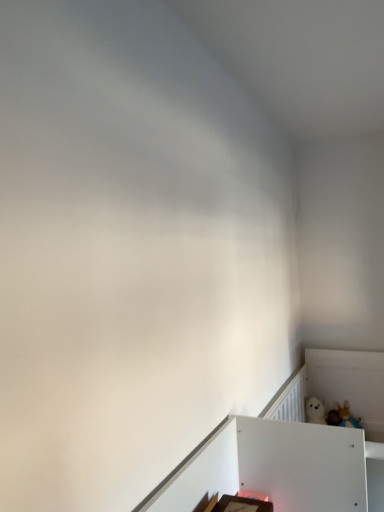
The width and height of the screenshot is (384, 512). In order to click on white plush bear at lower right in this screenshot , I will do `click(343, 417)`.

Describe the element at coordinates (343, 417) in the screenshot. The height and width of the screenshot is (512, 384). I see `white plush bear at lower right` at that location.

Where is `white matte bed frame at upper right`? white matte bed frame at upper right is located at coordinates (339, 386).

What do you see at coordinates (339, 386) in the screenshot? I see `white matte bed frame at upper right` at bounding box center [339, 386].

Where is `white plush bear at lower right`? white plush bear at lower right is located at coordinates (343, 417).

In the image, is white matte bed frame at upper right on the left side or the right side of white plush bear at lower right?

Clearly, white matte bed frame at upper right is on the left of white plush bear at lower right in the image.

Which is behind, white matte bed frame at upper right or white plush bear at lower right?

white plush bear at lower right is behind.

Does point (383, 361) come in front of point (343, 416)?

No, it is not.

From the image's perspective, is white matte bed frame at upper right on white plush bear at lower right?

Incorrect, from the image's perspective, white matte bed frame at upper right is lower than white plush bear at lower right.

From a real-world perspective, relative to white plush bear at lower right, is white matte bed frame at upper right vertically above or below?

white matte bed frame at upper right is below white plush bear at lower right.

Considering the sizes of objects white matte bed frame at upper right and white plush bear at lower right in the image provided, who is wider, white matte bed frame at upper right or white plush bear at lower right?

white matte bed frame at upper right is wider.

Considering the relative sizes of white matte bed frame at upper right and white plush bear at lower right in the image provided, is white matte bed frame at upper right shorter than white plush bear at lower right?

In fact, white matte bed frame at upper right may be taller than white plush bear at lower right.

Considering the sizes of objects white matte bed frame at upper right and white plush bear at lower right in the image provided, who is bigger, white matte bed frame at upper right or white plush bear at lower right?

Bigger between the two is white matte bed frame at upper right.

Is white matte bed frame at upper right completely or partially outside of white plush bear at lower right?

white matte bed frame at upper right lies outside white plush bear at lower right's area.

Is white matte bed frame at upper right positioned far away from white plush bear at lower right?

white matte bed frame at upper right is near white plush bear at lower right, not far away.

Does white matte bed frame at upper right turn towards white plush bear at lower right?

Yes, white matte bed frame at upper right is turned towards white plush bear at lower right.

How many degrees apart are the facing directions of white matte bed frame at upper right and white plush bear at lower right?

The facing directions of white matte bed frame at upper right and white plush bear at lower right are 88 degrees apart.

The image size is (384, 512). I want to click on toy lying above the white matte bed frame at upper right (from the image's perspective), so click(343, 417).

Does white plush bear at lower right appear on the right side of white matte bed frame at upper right?

Yes.

Does white plush bear at lower right come in front of white matte bed frame at upper right?

No, white plush bear at lower right is behind white matte bed frame at upper right.

Does point (345, 422) come closer to viewer compared to point (348, 372)?

Yes, it is.

Looking at this image, from the image's perspective, is white plush bear at lower right below white matte bed frame at upper right?

No, from the image's perspective, white plush bear at lower right is not beneath white matte bed frame at upper right.

From a real-world perspective, does white plush bear at lower right sit lower than white matte bed frame at upper right?

No, from a real-world perspective, white plush bear at lower right is not under white matte bed frame at upper right.

Does white plush bear at lower right have a lesser width compared to white matte bed frame at upper right?

Indeed, white plush bear at lower right has a lesser width compared to white matte bed frame at upper right.

From their relative heights in the image, would you say white plush bear at lower right is taller or shorter than white matte bed frame at upper right?

Clearly, white plush bear at lower right is shorter compared to white matte bed frame at upper right.

Based on their sizes in the image, would you say white plush bear at lower right is bigger or smaller than white matte bed frame at upper right?

In the image, white plush bear at lower right appears to be smaller than white matte bed frame at upper right.

Does white plush bear at lower right contain white matte bed frame at upper right?

No, white matte bed frame at upper right is not a part of white plush bear at lower right.

Is white plush bear at lower right beside white matte bed frame at upper right?

No, white plush bear at lower right is not with white matte bed frame at upper right.

Is white plush bear at lower right aimed at white matte bed frame at upper right?

Yes, white plush bear at lower right is turned towards white matte bed frame at upper right.

How many degrees apart are the facing directions of white plush bear at lower right and white matte bed frame at upper right?

88 degrees separate the facing orientations of white plush bear at lower right and white matte bed frame at upper right.

In the image, there is a white plush bear at lower right. In order to click on bed frame below it (from a real-world perspective) in this screenshot , I will do `click(339, 386)`.

Locate an element on the screen. The height and width of the screenshot is (512, 384). toy above the white matte bed frame at upper right (from a real-world perspective) is located at coordinates (343, 417).

Locate an element on the screen. toy behind the white matte bed frame at upper right is located at coordinates click(343, 417).